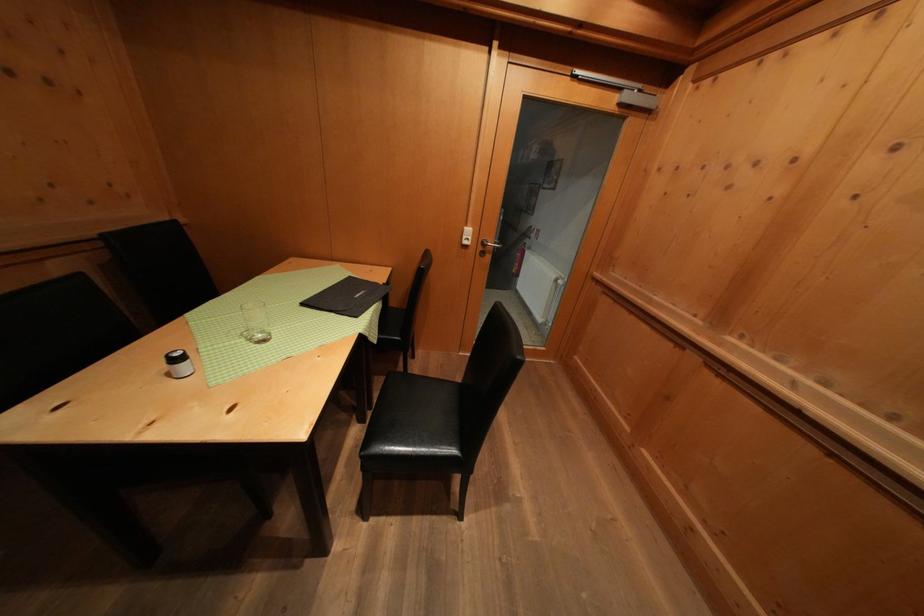
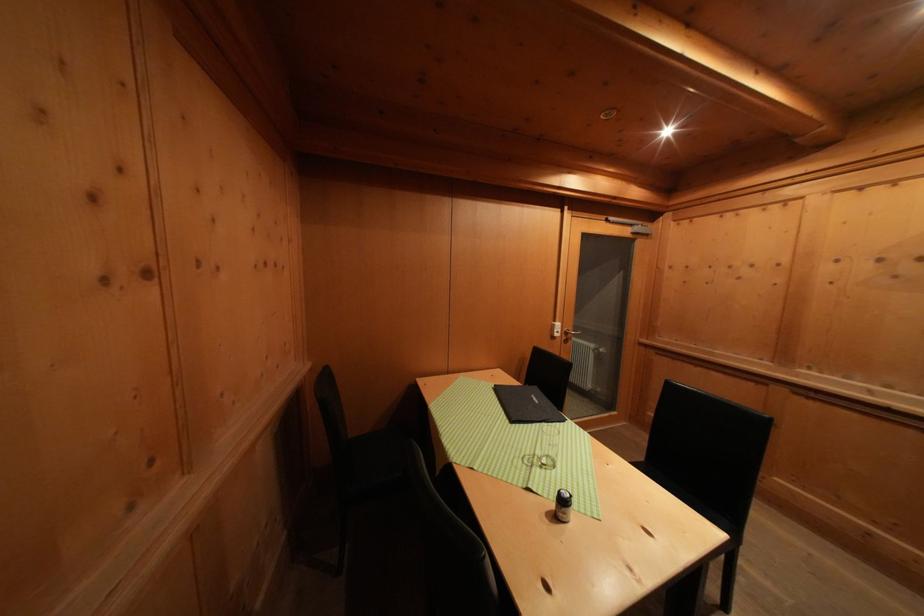
Where in the second image is the point corresponding to (363,301) from the first image?

(542, 406)